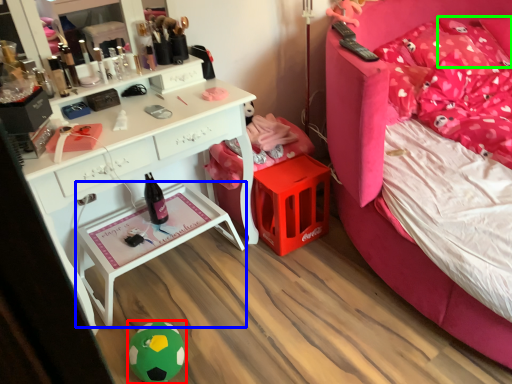
Question: Which object is positioned farthest from toy (highlighted by a red box)? Select from nightstand (highlighted by a blue box) and pillow (highlighted by a green box).

Choices:
 (A) nightstand
 (B) pillow

Answer: (B)